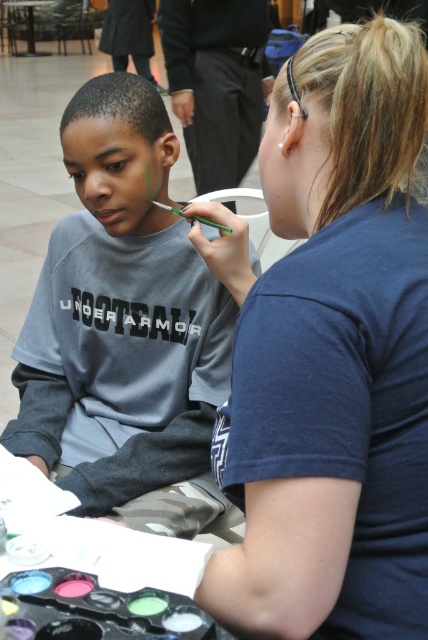
Question: Where is blue fabric shirt at upper right located in relation to matte gray shirt at left in the image?

Choices:
 (A) above
 (B) below

Answer: (B)

Question: Which point is closer to the camera?

Choices:
 (A) blue fabric shirt at upper right
 (B) matte gray shirt at left

Answer: (A)

Question: Can you confirm if blue fabric shirt at upper right is wider than matte gray shirt at left?

Choices:
 (A) yes
 (B) no

Answer: (B)

Question: Among these points, which one is nearest to the camera?

Choices:
 (A) (226, 273)
 (B) (58, 362)

Answer: (A)

Question: Can you confirm if blue fabric shirt at upper right is positioned to the right of matte gray shirt at left?

Choices:
 (A) yes
 (B) no

Answer: (A)